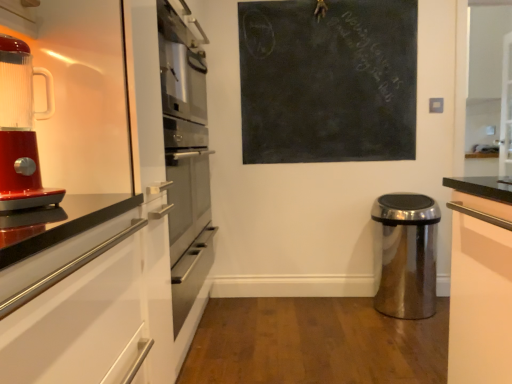
Question: From the image's perspective, relative to polished stainless steel trash can at lower right, is black chalkboard at upper center above or below?

Choices:
 (A) above
 (B) below

Answer: (A)

Question: From a real-world perspective, relative to polished stainless steel trash can at lower right, is black chalkboard at upper center vertically above or below?

Choices:
 (A) below
 (B) above

Answer: (B)

Question: Considering the real-world distances, which object is farthest from the polished stainless steel trash can at lower right?

Choices:
 (A) shiny red blender at left
 (B) black chalkboard at upper center

Answer: (A)

Question: Considering the real-world distances, which object is farthest from the polished stainless steel trash can at lower right?

Choices:
 (A) shiny red blender at left
 (B) black chalkboard at upper center

Answer: (A)